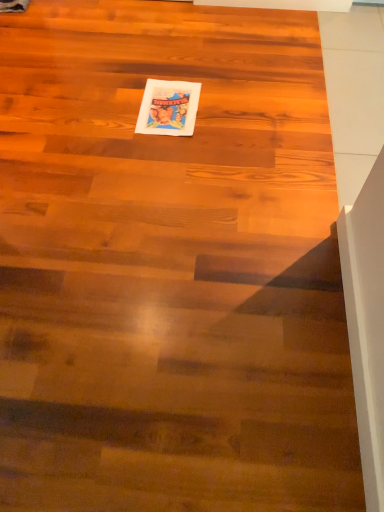
Describe the element at coordinates (168, 108) in the screenshot. I see `white paper book at center` at that location.

The image size is (384, 512). I want to click on white paper book at center, so click(168, 108).

Locate an element on the screen. The height and width of the screenshot is (512, 384). white paper book at center is located at coordinates (168, 108).